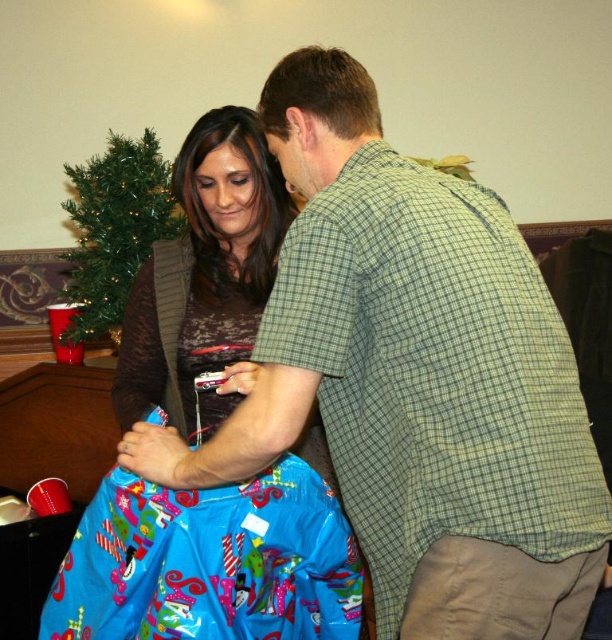
Which of these two, matte brown sweater at center or green artificial christmas tree at upper left, stands taller?

With more height is matte brown sweater at center.

You are a GUI agent. You are given a task and a screenshot of the screen. Output one action in this format:
    pyautogui.click(x=<x>, y=<y>)
    Task: Click on the matte brown sweater at center
    This screenshot has height=640, width=612.
    Given the screenshot: What is the action you would take?
    pyautogui.click(x=204, y=276)

What are the coordinates of `matte brown sweater at center` in the screenshot? It's located at (204, 276).